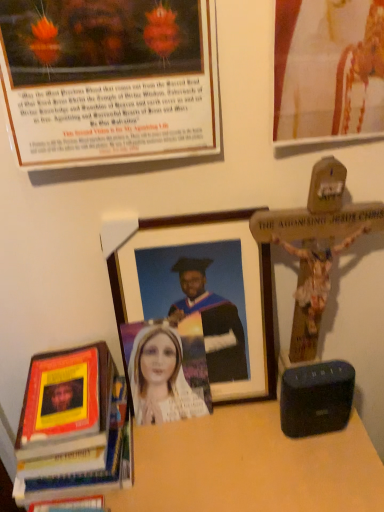
Question: Is matte gold picture frame at upper right, which is counted as the first picture frame, starting from the top, to the left of wooden picture frame at center, placed as the third picture frame when sorted from top to bottom, from the viewer's perspective?

Choices:
 (A) no
 (B) yes

Answer: (A)

Question: Would you say matte gold picture frame at upper right, the 3th picture frame positioned from the bottom, is outside wooden picture frame at center, acting as the 1th picture frame starting from the bottom?

Choices:
 (A) no
 (B) yes

Answer: (B)

Question: From a real-world perspective, is matte gold picture frame at upper right, which is counted as the first picture frame, starting from the top, on top of wooden picture frame at center, placed as the third picture frame when sorted from top to bottom?

Choices:
 (A) no
 (B) yes

Answer: (B)

Question: Can you confirm if matte gold picture frame at upper right, the 3th picture frame positioned from the bottom, is shorter than wooden picture frame at center, acting as the 1th picture frame starting from the bottom?

Choices:
 (A) no
 (B) yes

Answer: (A)

Question: Is matte gold picture frame at upper right, which is counted as the first picture frame, starting from the top, further to camera compared to wooden picture frame at center, placed as the third picture frame when sorted from top to bottom?

Choices:
 (A) no
 (B) yes

Answer: (A)

Question: In terms of height, does black plastic speaker at lower right look taller or shorter compared to matte gold picture frame at upper right, the 3th picture frame positioned from the bottom?

Choices:
 (A) short
 (B) tall

Answer: (A)

Question: Considering the positions of point (288, 407) and point (306, 53), is point (288, 407) closer or farther from the camera than point (306, 53)?

Choices:
 (A) closer
 (B) farther

Answer: (B)

Question: From a real-world perspective, is black plastic speaker at lower right physically located above or below matte gold picture frame at upper right, which is counted as the first picture frame, starting from the top?

Choices:
 (A) below
 (B) above

Answer: (A)

Question: From the image's perspective, is black plastic speaker at lower right positioned above or below matte gold picture frame at upper right, which is counted as the first picture frame, starting from the top?

Choices:
 (A) above
 (B) below

Answer: (B)

Question: In terms of size, does matte plastic portrait at center appear bigger or smaller than black plastic speaker at lower right?

Choices:
 (A) big
 (B) small

Answer: (A)

Question: Considering the positions of matte plastic portrait at center and black plastic speaker at lower right in the image, is matte plastic portrait at center wider or thinner than black plastic speaker at lower right?

Choices:
 (A) thin
 (B) wide

Answer: (A)

Question: Would you say matte plastic portrait at center is to the left or to the right of black plastic speaker at lower right in the picture?

Choices:
 (A) left
 (B) right

Answer: (A)

Question: Is point (195, 407) closer or farther from the camera than point (339, 373)?

Choices:
 (A) closer
 (B) farther

Answer: (B)

Question: From the image's perspective, is wooden table at lower center positioned above or below matte plastic portrait at center?

Choices:
 (A) above
 (B) below

Answer: (B)

Question: Is wooden table at lower center bigger or smaller than matte plastic portrait at center?

Choices:
 (A) big
 (B) small

Answer: (A)